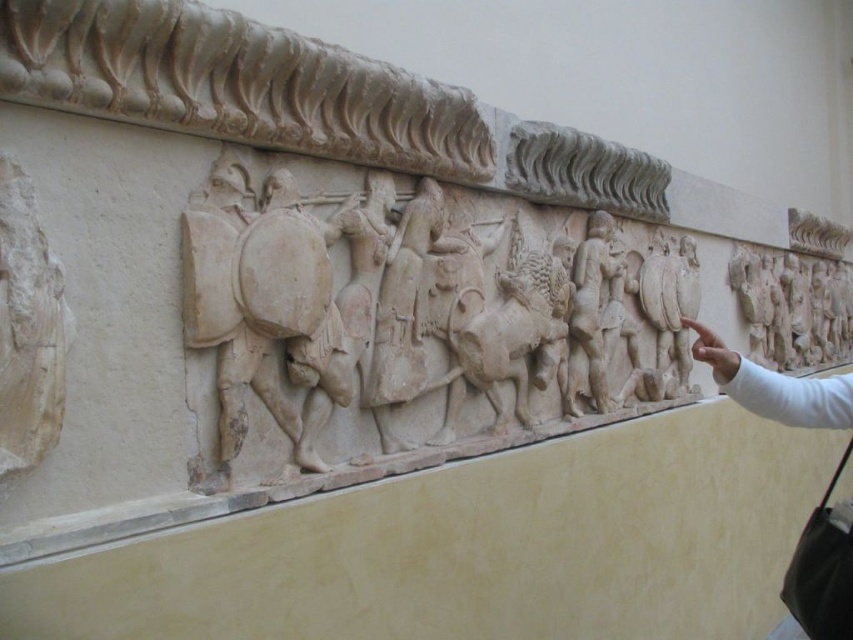
In the scene shown: How much distance is there between white stone relief at center and white stone warrior at center?

white stone relief at center is 16.36 inches from white stone warrior at center.

Is white stone relief at center smaller than white stone warrior at center?

No, white stone relief at center is not smaller than white stone warrior at center.

Find the location of a particular element. This screenshot has width=853, height=640. white stone relief at center is located at coordinates tap(405, 314).

The width and height of the screenshot is (853, 640). Find the location of `white stone relief at center`. white stone relief at center is located at coordinates (405, 314).

Describe the element at coordinates (792, 307) in the screenshot. I see `white stone relief at upper right` at that location.

Does white stone relief at upper right have a lesser height compared to white stone warrior at center?

Yes.

What do you see at coordinates (792, 307) in the screenshot?
I see `white stone relief at upper right` at bounding box center [792, 307].

Locate an element on the screen. white stone relief at upper right is located at coordinates (792, 307).

The width and height of the screenshot is (853, 640). What do you see at coordinates (405, 314) in the screenshot?
I see `white stone relief at center` at bounding box center [405, 314].

How far apart are white stone relief at center and white stone relief at upper right?

white stone relief at center and white stone relief at upper right are 7.88 feet apart from each other.

What do you see at coordinates (405, 314) in the screenshot?
I see `white stone relief at center` at bounding box center [405, 314].

The width and height of the screenshot is (853, 640). In order to click on white stone relief at center in this screenshot , I will do `click(405, 314)`.